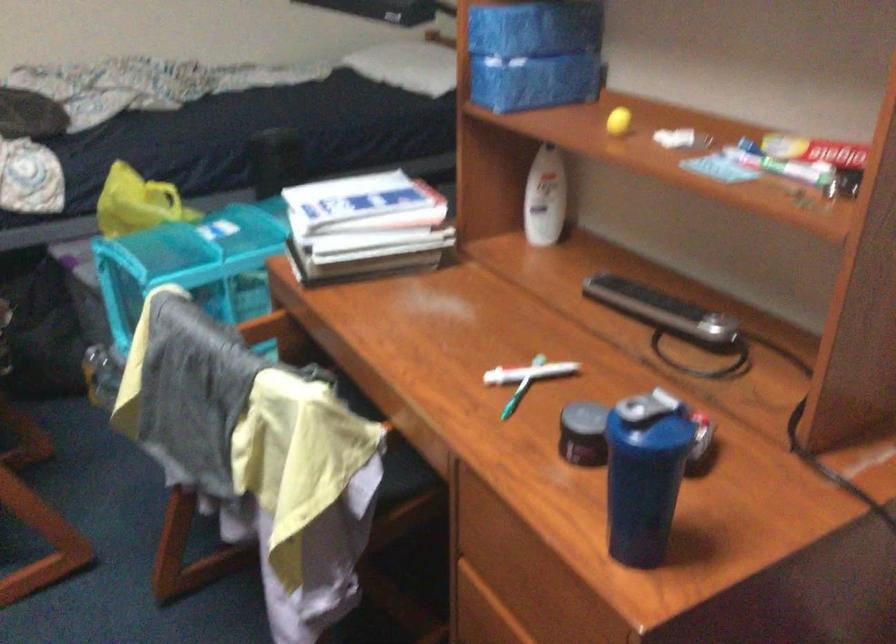
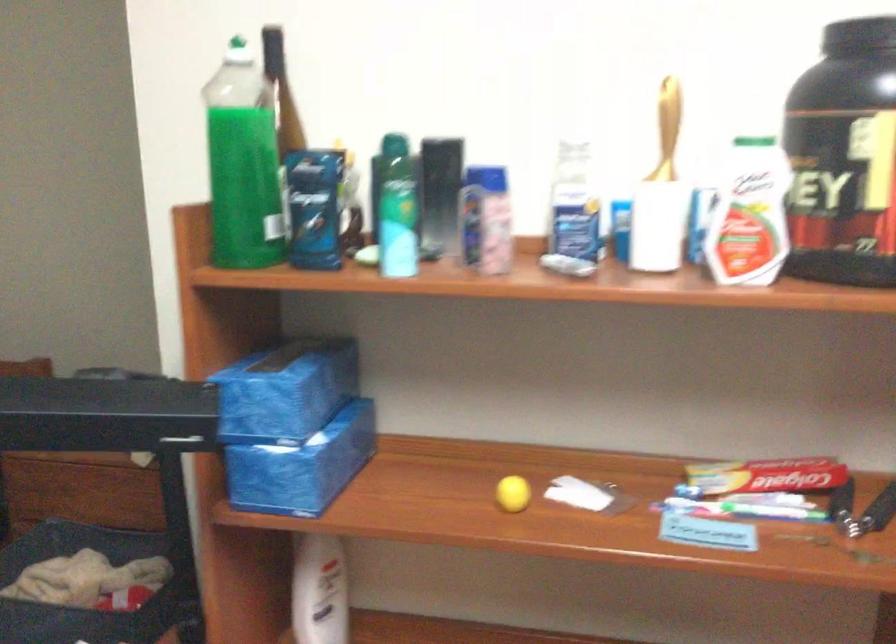
Question: How did the camera likely rotate?

Choices:
 (A) Left
 (B) Right
 (C) Up
 (D) Down

Answer: (B)